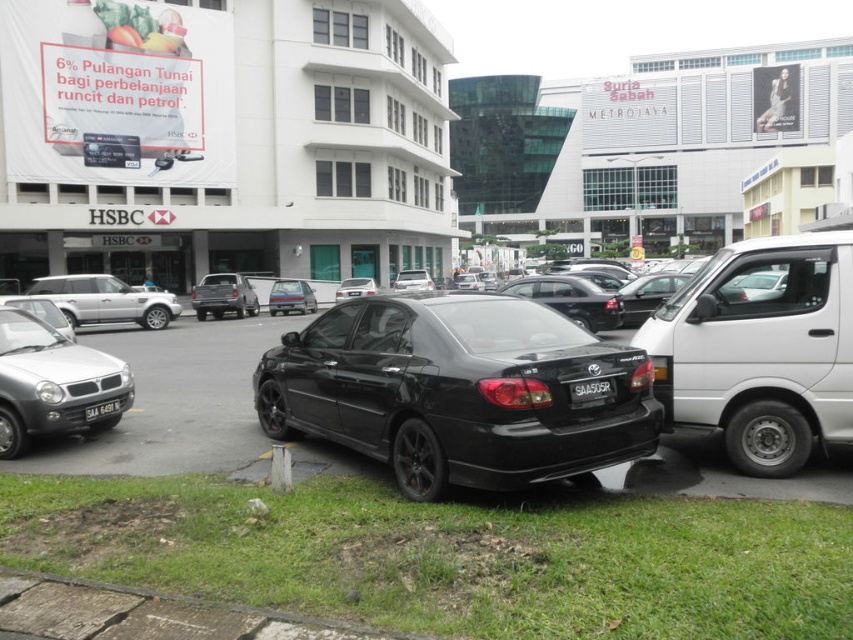
You are a delivery person trying to park your van in a spot between the silver metallic suv at left and the black plastic license plate at center. Based on the scene, will your van fit vertically between them?

The silver metallic suv at left is taller than the black plastic license plate at center. Since the suv is taller, the available vertical space between them may be insufficient for your van to fit comfortably. It is recommended to look for another parking spot.